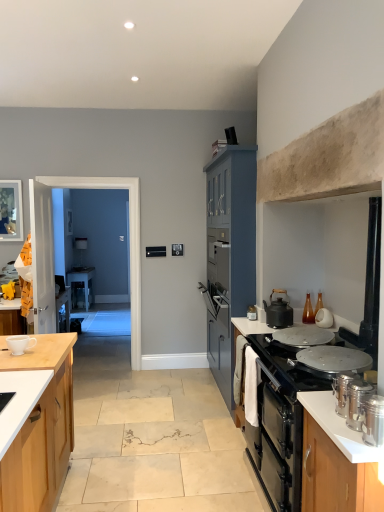
Find the location of a particular element. The width and height of the screenshot is (384, 512). unoccupied area in front of matte black kettle at right, the fourth kitchen appliance from the front is located at coordinates (251, 326).